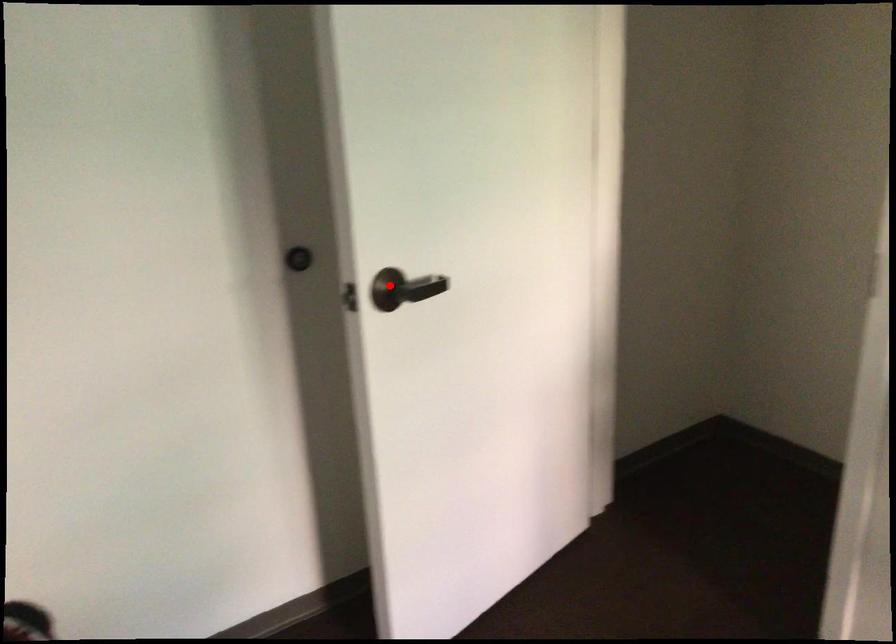
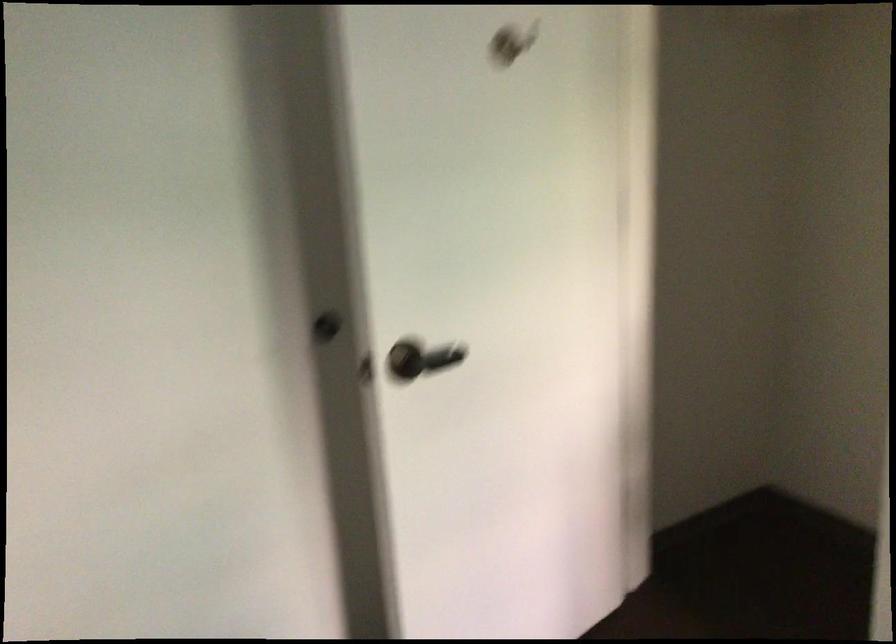
Find the pixel in the second image that matches the highlighted location in the first image.

(407, 359)